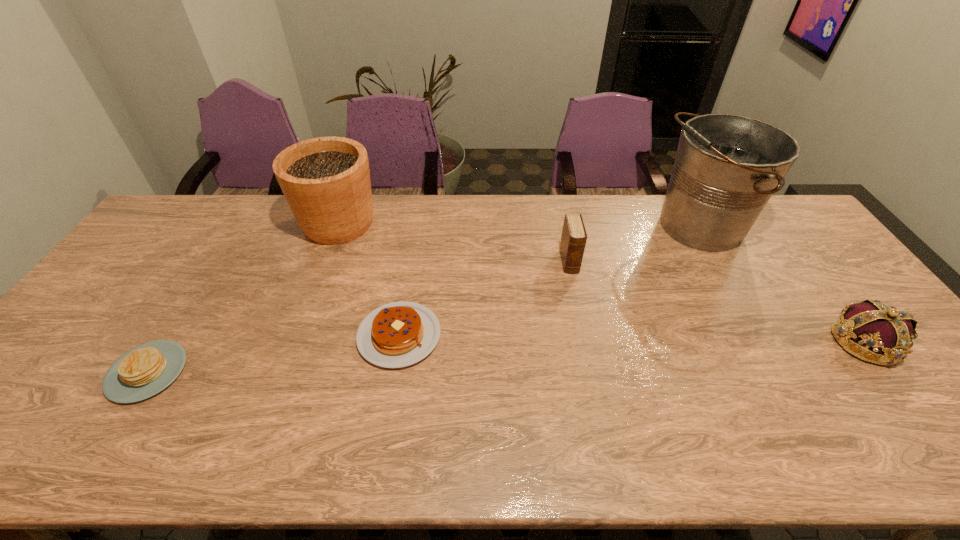
This screenshot has height=540, width=960. In order to click on vacant area that lies between the right pancake and the crown in this screenshot , I will do `click(632, 339)`.

Identify the location of empty space between the leftmost object and the crown. (505, 356).

Locate an element on the screen. The width and height of the screenshot is (960, 540). vacant area between the left pancake and the right pancake is located at coordinates (273, 354).

Identify the location of free space that is in between the bucket and the crown. Image resolution: width=960 pixels, height=540 pixels. (781, 284).

Image resolution: width=960 pixels, height=540 pixels. I want to click on free space between the rightmost object and the left pancake, so click(505, 356).

Image resolution: width=960 pixels, height=540 pixels. What are the coordinates of `vacant space that's between the third object from right to left and the leftmost object` in the screenshot? It's located at (358, 317).

Find the location of `vacant area between the fourth object from right to left and the left pancake`. vacant area between the fourth object from right to left and the left pancake is located at coordinates (273, 354).

Where is `blank region between the tallest object and the left pancake`? blank region between the tallest object and the left pancake is located at coordinates (423, 299).

This screenshot has width=960, height=540. I want to click on free space between the rightmost object and the bucket, so click(x=781, y=284).

Where is `blank region between the crown and the flowerpot`? blank region between the crown and the flowerpot is located at coordinates 601,282.